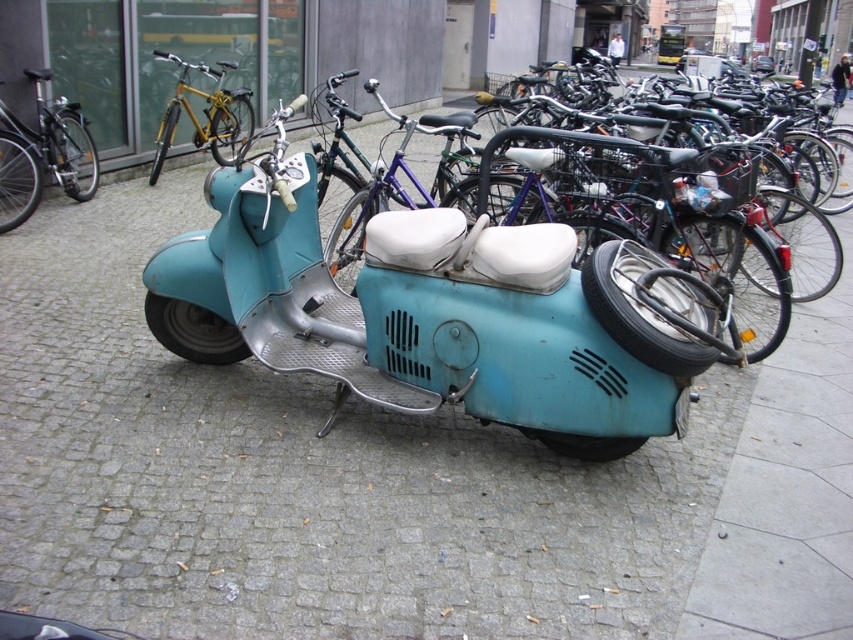
Question: Does shiny silver bicycle at left appear under gold metallic bicycle at upper left?

Choices:
 (A) yes
 (B) no

Answer: (A)

Question: In this image, where is matte blue scooter at center located relative to gold metallic bicycle at upper left?

Choices:
 (A) below
 (B) above

Answer: (A)

Question: Which point is farther to the camera?

Choices:
 (A) (732, 209)
 (B) (201, 138)

Answer: (B)

Question: Does shiny silver bicycle at left have a smaller size compared to gold metallic bicycle at upper left?

Choices:
 (A) yes
 (B) no

Answer: (A)

Question: Which of these objects is positioned farthest from the gold metallic bicycle at upper left?

Choices:
 (A) shiny silver bicycle at left
 (B) matte blue scooter at center

Answer: (B)

Question: Which point is farther from the camera taking this photo?

Choices:
 (A) (28, 189)
 (B) (572, 224)

Answer: (A)